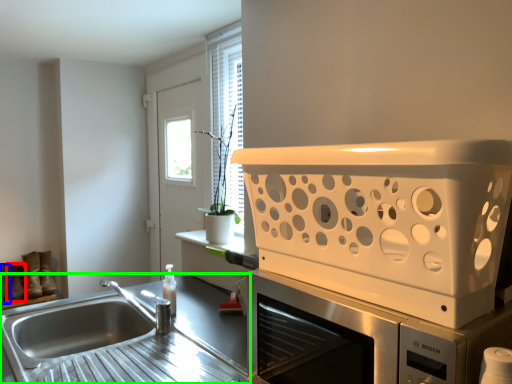
Question: Which object is positioned farthest from shoe (highlighted by a red box)? Select from shoe (highlighted by a blue box) and countertop (highlighted by a green box).

Choices:
 (A) shoe
 (B) countertop

Answer: (B)